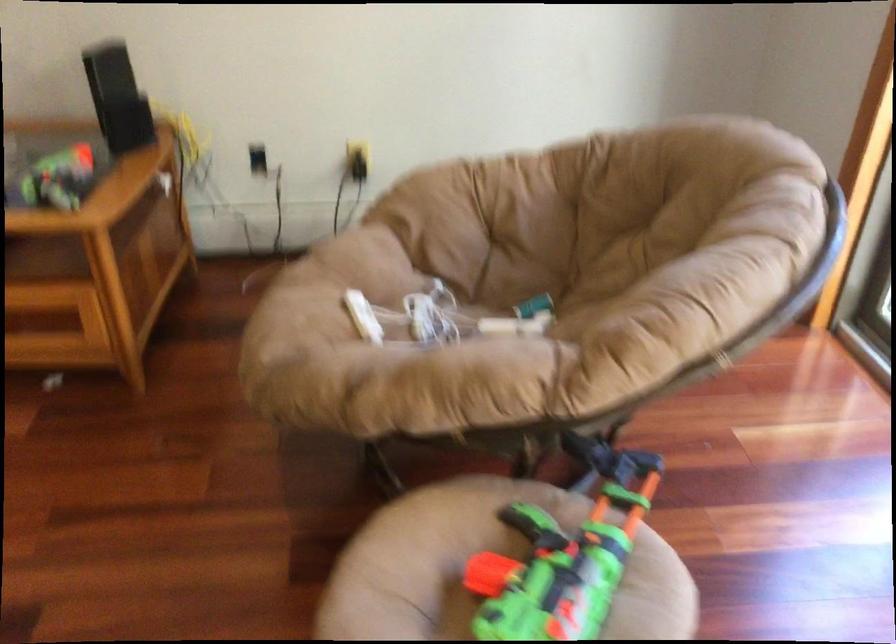
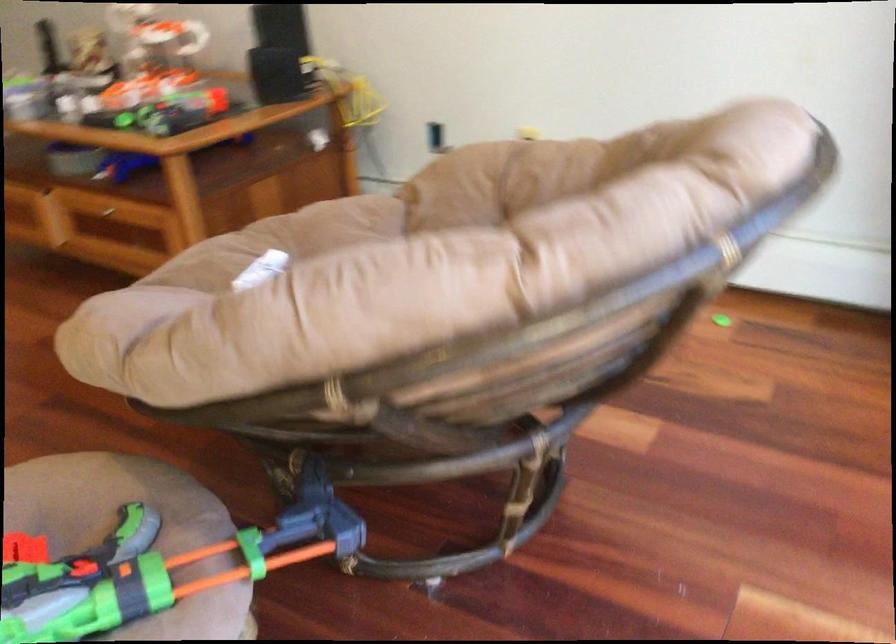
Where in the second image is the point corresponding to point 564,515 from the first image?

(134, 527)